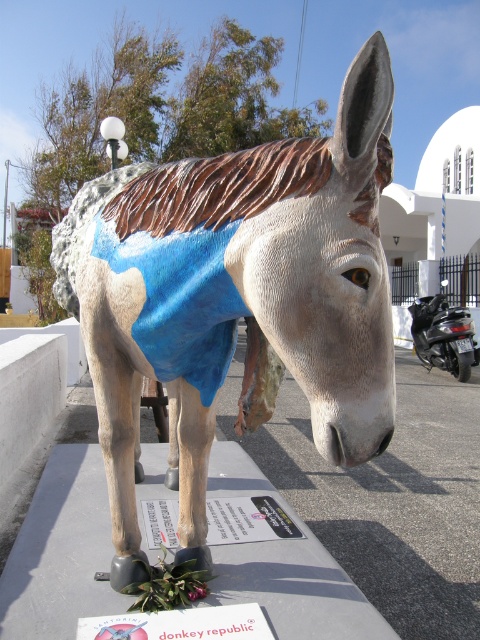
You are standing in front of the statue and want to place a small gift at the base of the matte blue fabric donkey at center. However, there is a shiny black scooter at right blocking your path. Can you walk around the scooter to reach the donkey?

The matte blue fabric donkey at center is closer to the viewer than the shiny black scooter at right, so you can walk around the scooter to reach the donkey.

You are a delivery person who needs to park your shiny black scooter at right near the matte blue fabric donkey at center without blocking the walkway. Can you park the scooter next to the donkey if the walkway is 1.2 meters wide?

The matte blue fabric donkey at center might be wider than the shiny black scooter at right. Since the walkway is only 1.2 meters wide, it depends on the exact width of the donkey. If the donkey is wider than the scooter, there might not be enough space to park the scooter without blocking the walkway.

You are standing in front of the statue of the donkey. There are two points marked on the statue. The first point is at coordinate point (112, 305) and the second point is at coordinate point (442, 292). Which point is closer to you?

Point (112, 305) is closer to the viewer than point (442, 292).